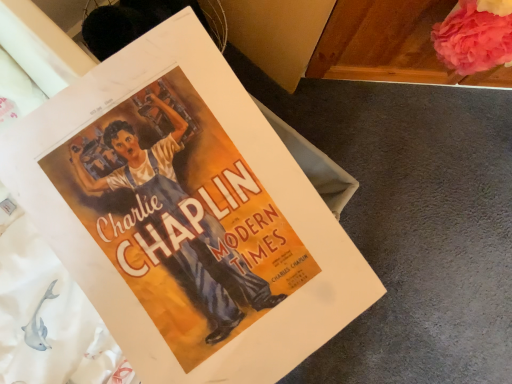
Measure the distance between matte paper poster at center and camera.

matte paper poster at center is 13.32 inches away from camera.

Image resolution: width=512 pixels, height=384 pixels. I want to click on matte paper poster at center, so click(186, 215).

Based on the photo, in order to face matte paper poster at center, should I rotate leftwards or rightwards?

You should look left and rotate roughly 12.717 degrees.

This screenshot has height=384, width=512. What do you see at coordinates (186, 215) in the screenshot?
I see `matte paper poster at center` at bounding box center [186, 215].

You are a GUI agent. You are given a task and a screenshot of the screen. Output one action in this format:
    pyautogui.click(x=<x>, y=<y>)
    Task: Click on the matte paper poster at center
    
    Given the screenshot: What is the action you would take?
    pyautogui.click(x=186, y=215)